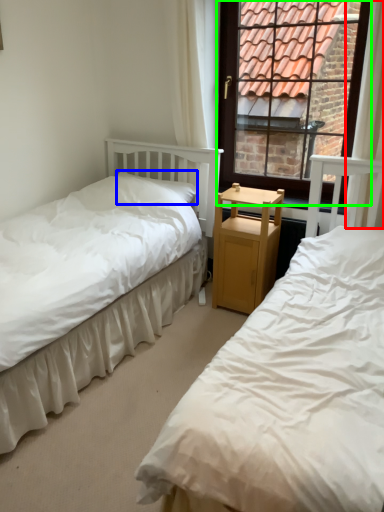
Question: Which is farther away from curtain (highlighted by a red box)? pillow (highlighted by a blue box) or window (highlighted by a green box)?

Choices:
 (A) pillow
 (B) window

Answer: (B)